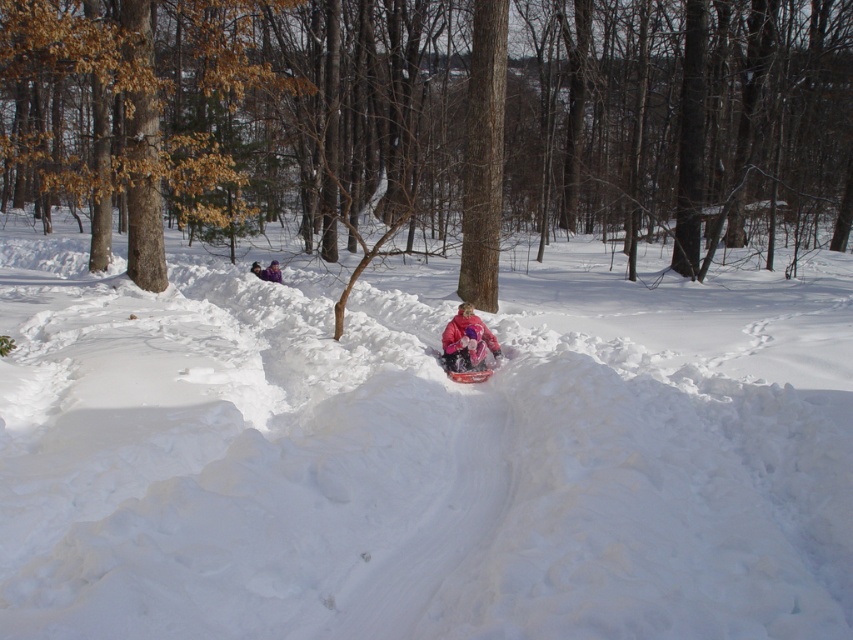
Between white fluffy snow at center and pink fleece jacket at center, which one appears on the left side from the viewer's perspective?

From the viewer's perspective, pink fleece jacket at center appears more on the left side.

Which is below, white fluffy snow at center or pink fleece jacket at center?

Positioned lower is pink fleece jacket at center.

The width and height of the screenshot is (853, 640). What are the coordinates of `white fluffy snow at center` in the screenshot? It's located at (421, 448).

Which is more to the right, white fluffy snow at center or brown rough tree at center?

white fluffy snow at center

Is white fluffy snow at center taller than brown rough tree at center?

No, white fluffy snow at center is not taller than brown rough tree at center.

At what (x,y) coordinates should I click in order to perform the action: click on white fluffy snow at center. Please return your answer as a coordinate pair (x, y). The width and height of the screenshot is (853, 640). Looking at the image, I should click on (421, 448).

The image size is (853, 640). Describe the element at coordinates (431, 124) in the screenshot. I see `brown rough tree at center` at that location.

Is brown rough tree at center shorter than pink fleece jacket at center?

No.

What do you see at coordinates (431, 124) in the screenshot? I see `brown rough tree at center` at bounding box center [431, 124].

Locate an element on the screen. Image resolution: width=853 pixels, height=640 pixels. brown rough tree at center is located at coordinates (431, 124).